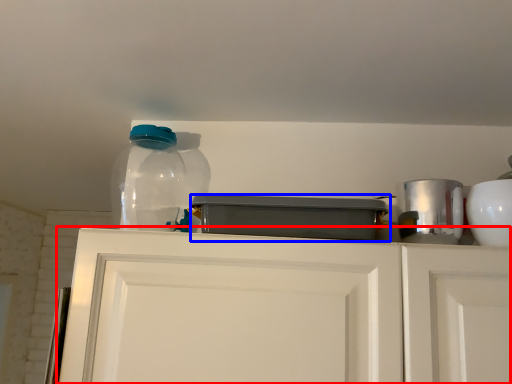
Question: Which of the following is the closest to the observer, cabinetry (highlighted by a red box) or appliance (highlighted by a blue box)?

Choices:
 (A) cabinetry
 (B) appliance

Answer: (A)